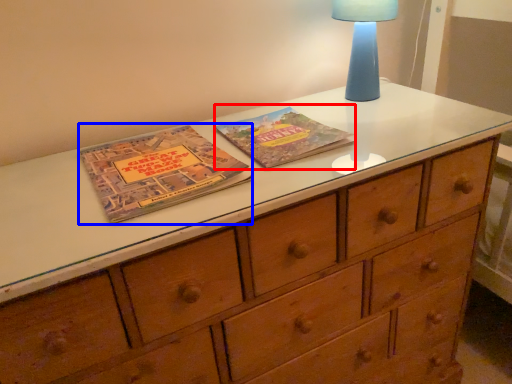
Question: Which of the following is the closest to the observer, paperback book (highlighted by a red box) or paperback book (highlighted by a blue box)?

Choices:
 (A) paperback book
 (B) paperback book

Answer: (B)